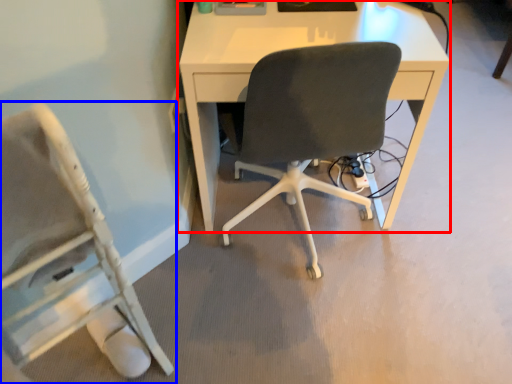
Question: Which object is further to the camera taking this photo, desk (highlighted by a red box) or chair (highlighted by a blue box)?

Choices:
 (A) desk
 (B) chair

Answer: (A)